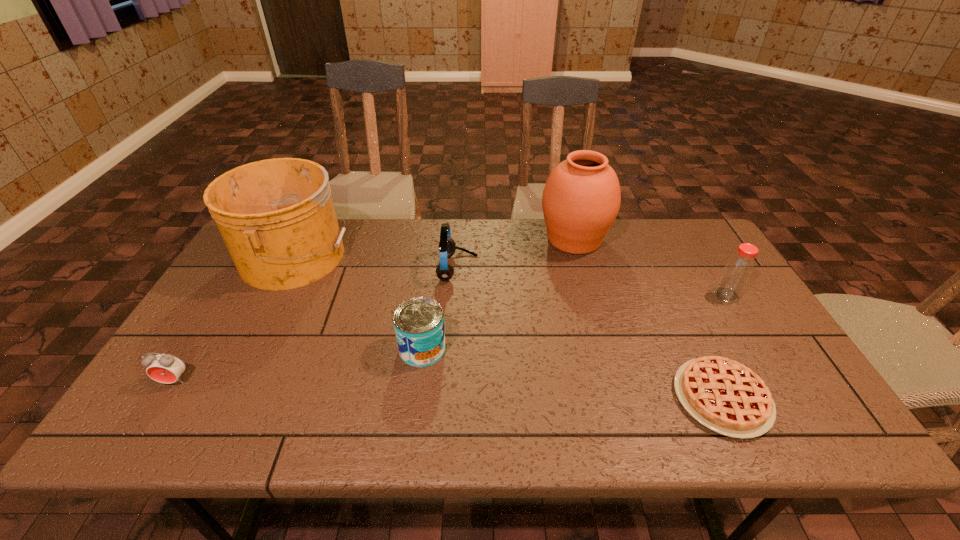
I want to click on vacant area situated 0.160m on the left of the bottle, so click(x=659, y=295).

Locate an element on the screen. free spot located with the microphone attached to the side of the headset is located at coordinates [576, 268].

The height and width of the screenshot is (540, 960). I want to click on free location located on the right of the can, so (x=506, y=349).

I want to click on vacant space situated on the face of the sixth tallest object, so click(149, 423).

Where is `free space located 0.080m on the back of the second object from right to left`? The image size is (960, 540). free space located 0.080m on the back of the second object from right to left is located at coordinates (692, 336).

The width and height of the screenshot is (960, 540). In order to click on urn that is at the far edge in this screenshot , I will do 581,199.

Locate an element on the screen. bucket at the far edge is located at coordinates (276, 216).

Locate an element on the screen. Image resolution: width=960 pixels, height=540 pixels. headset located in the far edge section of the desktop is located at coordinates (444, 271).

At what (x,y) coordinates should I click in order to perform the action: click on object located in the near edge section of the desktop. Please return your answer as a coordinate pair (x, y). The image size is (960, 540). Looking at the image, I should click on (727, 397).

Where is `bucket positioned at the left edge`? This screenshot has width=960, height=540. bucket positioned at the left edge is located at coordinates (276, 216).